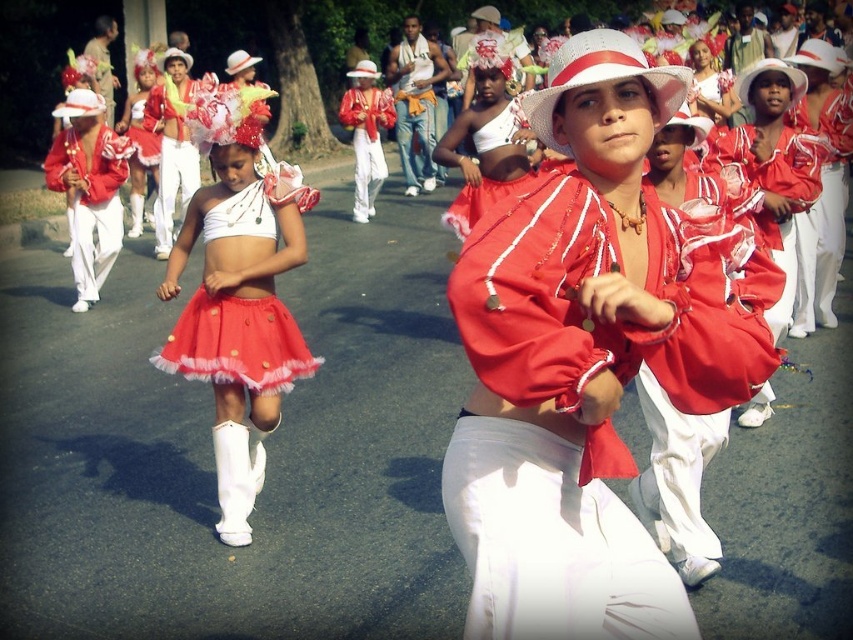
Question: Which of the following is the farthest from the observer?

Choices:
 (A) white fabric hat at center
 (B) matte white skirt at center
 (C) matte red skirt at center
 (D) matte red blouse at center

Answer: (A)

Question: In this image, where is matte white skirt at center located relative to white fabric hat at center?

Choices:
 (A) right
 (B) left

Answer: (A)

Question: Among these points, which one is nearest to the camera?

Choices:
 (A) (770, 67)
 (B) (213, 445)
 (C) (286, 353)

Answer: (C)

Question: Which of the following is the closest to the observer?

Choices:
 (A) white matte hat at center
 (B) matte white skirt at center

Answer: (A)

Question: Is matte red blouse at center to the left of matte red skirt at center from the viewer's perspective?

Choices:
 (A) no
 (B) yes

Answer: (A)

Question: Does matte red blouse at center appear over matte white skirt at center?

Choices:
 (A) no
 (B) yes

Answer: (A)